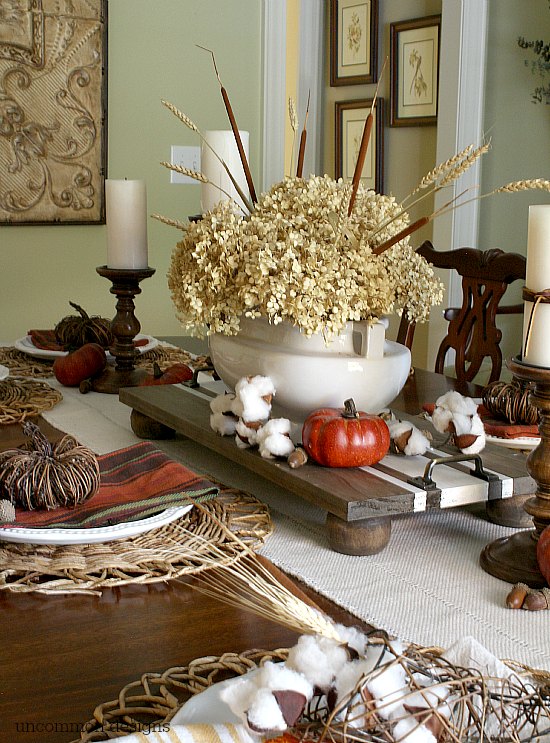
Find the location of `wood chair`. wood chair is located at coordinates (478, 272).